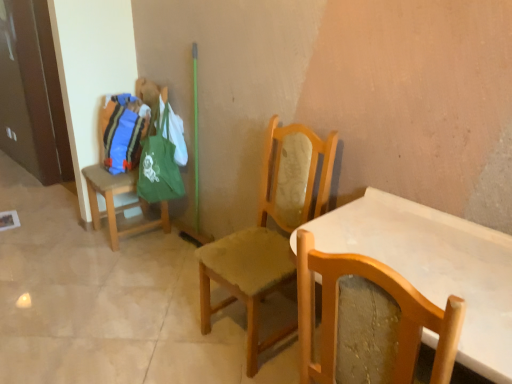
Question: Considering the relative sizes of wooden stool at left, acting as the 1th chair starting from the back, and wooden chair at center, the second chair from the front, in the image provided, is wooden stool at left, acting as the 1th chair starting from the back, bigger than wooden chair at center, the second chair from the front,?

Choices:
 (A) yes
 (B) no

Answer: (B)

Question: Is wooden stool at left, which is the first chair in left-to-right order, positioned beyond the bounds of wooden chair at center, the second chair from the front?

Choices:
 (A) yes
 (B) no

Answer: (A)

Question: From the image's perspective, is wooden stool at left, acting as the 1th chair starting from the back, on top of wooden chair at center, arranged as the 2th chair when viewed from the right?

Choices:
 (A) no
 (B) yes

Answer: (B)

Question: Is wooden stool at left, the third chair when ordered from front to back, smaller than wooden chair at center, arranged as the 2th chair when viewed from the right?

Choices:
 (A) no
 (B) yes

Answer: (B)

Question: Is wooden stool at left, the third chair when ordered from front to back, turned away from wooden chair at center, which ranks as the second chair in back-to-front order?

Choices:
 (A) yes
 (B) no

Answer: (B)

Question: Is wooden stool at left, the third chair when ordered from front to back, spatially inside wooden chair at center, the second chair from the front, or outside of it?

Choices:
 (A) outside
 (B) inside

Answer: (A)

Question: Based on their sizes in the image, would you say wooden stool at left, which is the first chair in left-to-right order, is bigger or smaller than wooden chair at center, the second chair from the front?

Choices:
 (A) small
 (B) big

Answer: (A)

Question: From a real-world perspective, is wooden stool at left, which is the first chair in left-to-right order, physically located above or below wooden chair at center, which ranks as the second chair in back-to-front order?

Choices:
 (A) below
 (B) above

Answer: (A)

Question: Relative to wooden chair at center, placed as the 2th chair when sorted from left to right, is wooden stool at left, acting as the third chair starting from the right, in front or behind?

Choices:
 (A) behind
 (B) front

Answer: (A)

Question: Is wooden chair at right, which is the first chair in front-to-back order, in front of or behind wooden chair at center, the second chair from the front, in the image?

Choices:
 (A) front
 (B) behind

Answer: (A)

Question: From a real-world perspective, relative to wooden chair at center, which ranks as the second chair in back-to-front order, is wooden chair at right, which is the first chair in front-to-back order, vertically above or below?

Choices:
 (A) above
 (B) below

Answer: (A)

Question: In the image, is wooden chair at right, which is the first chair in front-to-back order, on the left side or the right side of wooden chair at center, arranged as the 2th chair when viewed from the right?

Choices:
 (A) left
 (B) right

Answer: (B)

Question: In terms of width, does wooden chair at right, which ranks as the third chair in back-to-front order, look wider or thinner when compared to wooden chair at center, placed as the 2th chair when sorted from left to right?

Choices:
 (A) wide
 (B) thin

Answer: (A)

Question: Considering the positions of wooden chair at right, the 1th chair in the right-to-left sequence, and wooden stool at left, acting as the third chair starting from the right, in the image, is wooden chair at right, the 1th chair in the right-to-left sequence, wider or thinner than wooden stool at left, acting as the third chair starting from the right,?

Choices:
 (A) wide
 (B) thin

Answer: (A)

Question: Considering the positions of wooden chair at right, arranged as the third chair when viewed from the left, and wooden stool at left, which is the first chair in left-to-right order, in the image, is wooden chair at right, arranged as the third chair when viewed from the left, taller or shorter than wooden stool at left, which is the first chair in left-to-right order,?

Choices:
 (A) tall
 (B) short

Answer: (B)